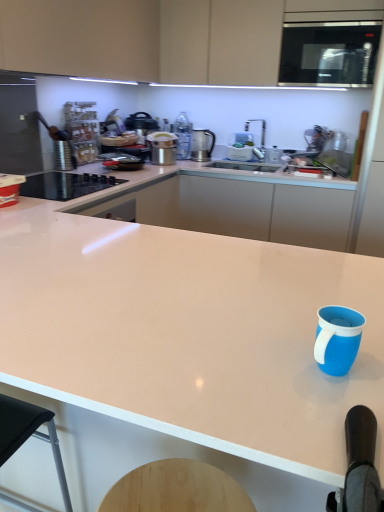
Question: Which direction should I rotate to look at metallic silver pot at upper center, positioned as the 2th kitchen appliance in right-to-left order?

Choices:
 (A) left
 (B) right

Answer: (A)

Question: Does white glossy countertop at center, which is the 2th countertop in front-to-back order, have a larger size compared to black glass cooktop at left?

Choices:
 (A) no
 (B) yes

Answer: (B)

Question: Is white glossy countertop at center, the first countertop positioned from the back, to the right of black glass cooktop at left from the viewer's perspective?

Choices:
 (A) no
 (B) yes

Answer: (B)

Question: Is white glossy countertop at center, the first countertop positioned from the back, smaller than black glass cooktop at left?

Choices:
 (A) no
 (B) yes

Answer: (A)

Question: From the image's perspective, would you say white glossy countertop at center, the first countertop positioned from the back, is shown under black glass cooktop at left?

Choices:
 (A) no
 (B) yes

Answer: (B)

Question: Would you say white glossy countertop at center, the first countertop positioned from the back, contains black glass cooktop at left?

Choices:
 (A) yes
 (B) no

Answer: (B)

Question: Is white glossy countertop at center, the first countertop positioned from the back, at the right side of satin silver kettle at upper center, marked as the 1th kitchen appliance in a right-to-left arrangement?

Choices:
 (A) no
 (B) yes

Answer: (B)

Question: Is white glossy countertop at center, which is the 2th countertop in front-to-back order, turned away from satin silver kettle at upper center, marked as the 1th kitchen appliance in a right-to-left arrangement?

Choices:
 (A) no
 (B) yes

Answer: (A)

Question: Is white glossy countertop at center, which is the 2th countertop in front-to-back order, in contact with satin silver kettle at upper center, marked as the 1th kitchen appliance in a right-to-left arrangement?

Choices:
 (A) no
 (B) yes

Answer: (A)

Question: Considering the relative sizes of white glossy countertop at center, the first countertop positioned from the back, and satin silver kettle at upper center, marked as the 2th kitchen appliance in a left-to-right arrangement, in the image provided, is white glossy countertop at center, the first countertop positioned from the back, bigger than satin silver kettle at upper center, marked as the 2th kitchen appliance in a left-to-right arrangement,?

Choices:
 (A) no
 (B) yes

Answer: (B)

Question: Considering the relative sizes of white glossy countertop at center, the first countertop positioned from the back, and satin silver kettle at upper center, marked as the 2th kitchen appliance in a left-to-right arrangement, in the image provided, is white glossy countertop at center, the first countertop positioned from the back, taller than satin silver kettle at upper center, marked as the 2th kitchen appliance in a left-to-right arrangement,?

Choices:
 (A) yes
 (B) no

Answer: (A)

Question: Can you confirm if white glossy countertop at center, the first countertop positioned from the back, is thinner than satin silver kettle at upper center, arranged as the first kitchen appliance when viewed from the back?

Choices:
 (A) no
 (B) yes

Answer: (A)

Question: Does black glass cooktop at left lie behind white glossy countertop at center, acting as the 2th countertop starting from the back?

Choices:
 (A) no
 (B) yes

Answer: (B)